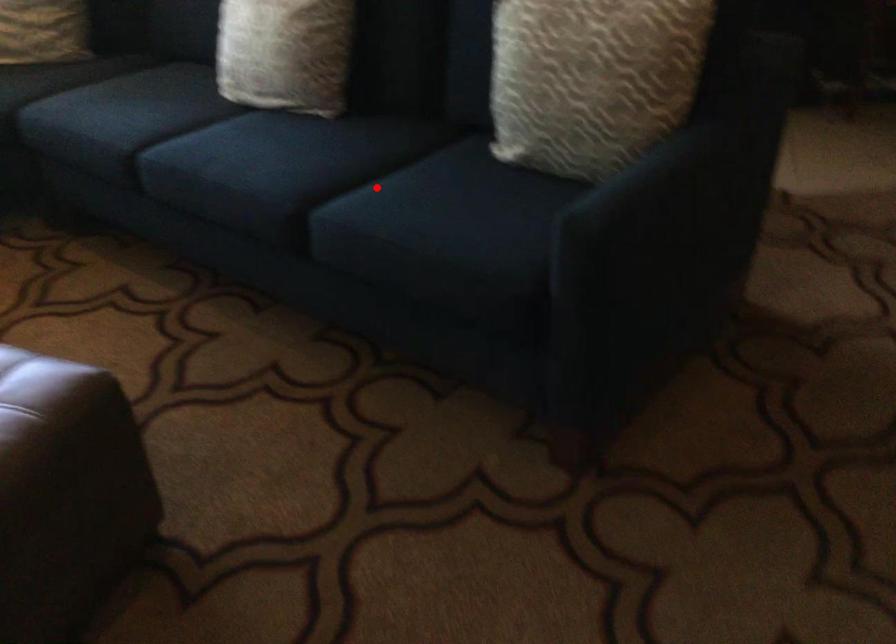
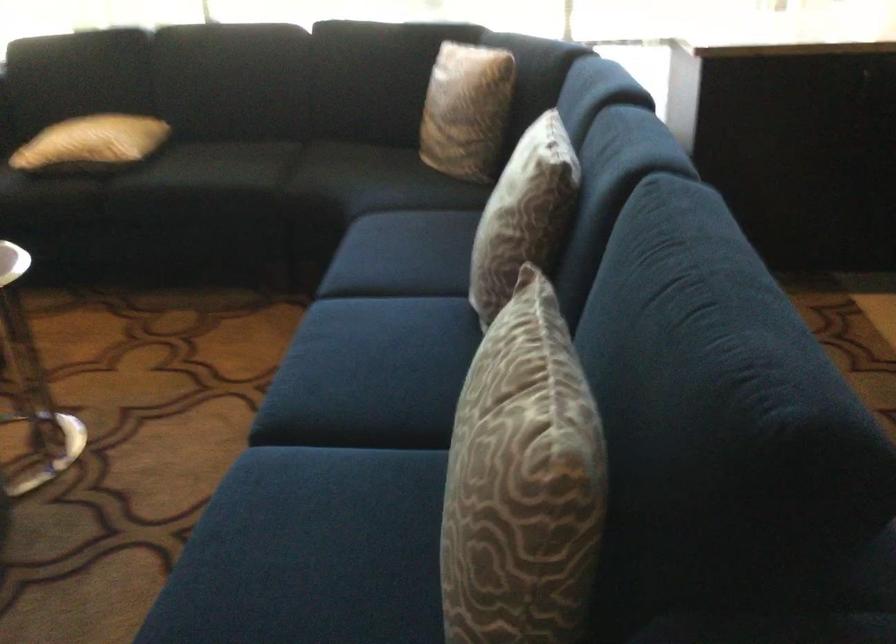
Question: I am providing you with two images of the same scene from different viewpoints. In image1, a red point is highlighted. Considering the same 3D point in image2, which of the following is correct?

Choices:
 (A) It is closer
 (B) It is farther

Answer: (A)